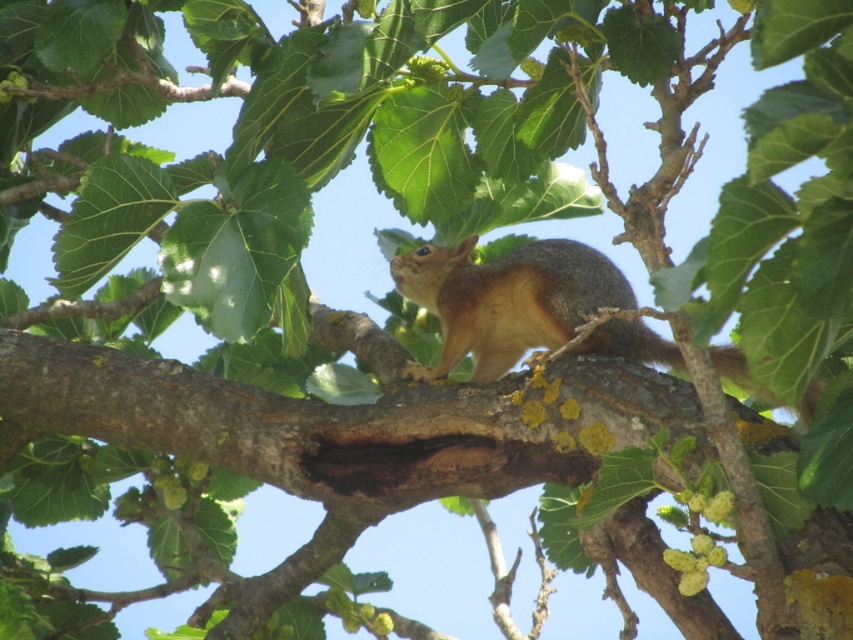
Question: Can you confirm if shiny brown fur squirrel at center is wider than brown furry tail at right?

Choices:
 (A) yes
 (B) no

Answer: (A)

Question: Which point is farther to the camera?

Choices:
 (A) shiny brown fur squirrel at center
 (B) brown furry tail at right

Answer: (A)

Question: Which point is closer to the camera taking this photo?

Choices:
 (A) (807, 413)
 (B) (730, 355)

Answer: (A)

Question: Can you confirm if shiny brown fur squirrel at center is positioned below brown furry tail at right?

Choices:
 (A) no
 (B) yes

Answer: (A)

Question: Can you confirm if shiny brown fur squirrel at center is smaller than brown furry tail at right?

Choices:
 (A) no
 (B) yes

Answer: (A)